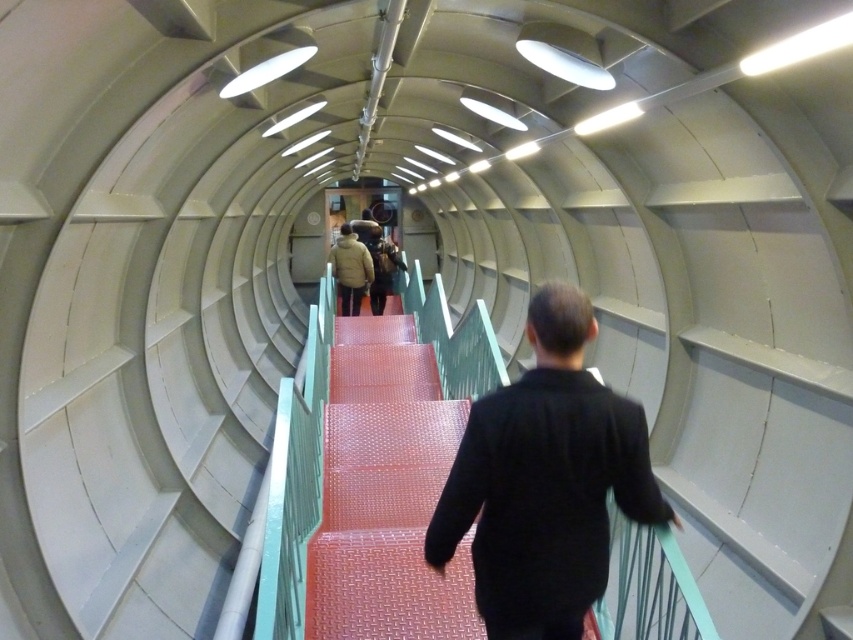
Is red textured stairs at center to the left of matte brown jacket at center from the viewer's perspective?

Incorrect, red textured stairs at center is not on the left side of matte brown jacket at center.

Is red textured stairs at center further to the viewer compared to matte brown jacket at center?

No.

This screenshot has width=853, height=640. Describe the element at coordinates (393, 481) in the screenshot. I see `red textured stairs at center` at that location.

Image resolution: width=853 pixels, height=640 pixels. In order to click on red textured stairs at center in this screenshot , I will do `click(393, 481)`.

From the picture: Can you confirm if black matte jacket at center is thinner than matte brown jacket at center?

No, black matte jacket at center is not thinner than matte brown jacket at center.

Can you confirm if black matte jacket at center is smaller than matte brown jacket at center?

Correct, black matte jacket at center occupies less space than matte brown jacket at center.

Between point (535, 524) and point (354, 296), which one is positioned behind?

The point (354, 296) is behind.

Locate an element on the screen. The height and width of the screenshot is (640, 853). black matte jacket at center is located at coordinates (544, 481).

Can you confirm if black matte jacket at center is smaller than red textured stairs at center?

Incorrect, black matte jacket at center is not smaller in size than red textured stairs at center.

Does point (486, 570) lie in front of point (402, 388)?

Yes, it is in front of point (402, 388).

Where is `black matte jacket at center`? black matte jacket at center is located at coordinates (544, 481).